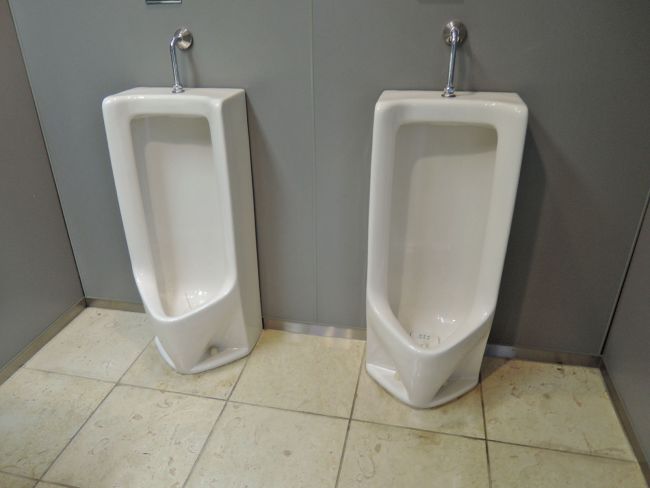
Image resolution: width=650 pixels, height=488 pixels. In order to click on tile in this screenshot , I will do `click(574, 402)`.